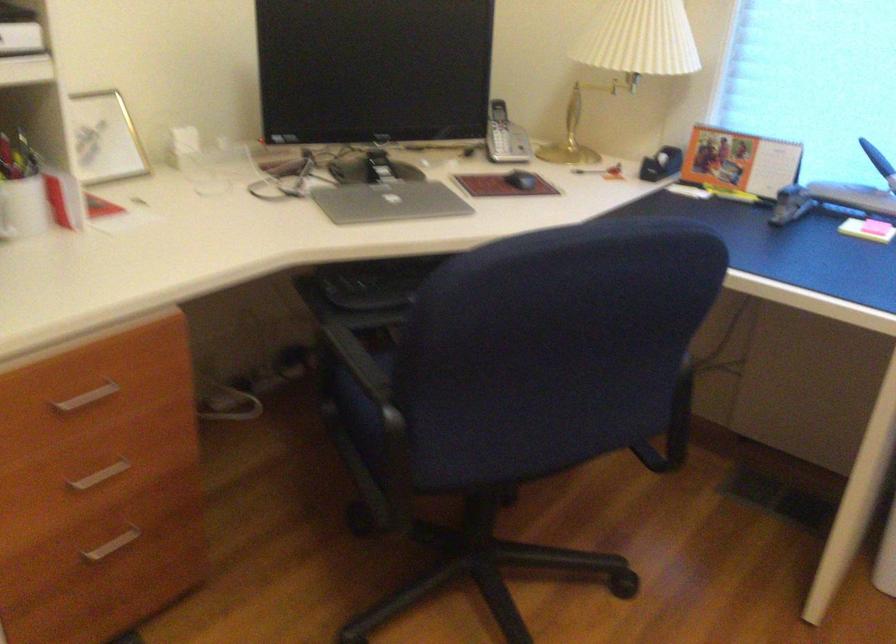
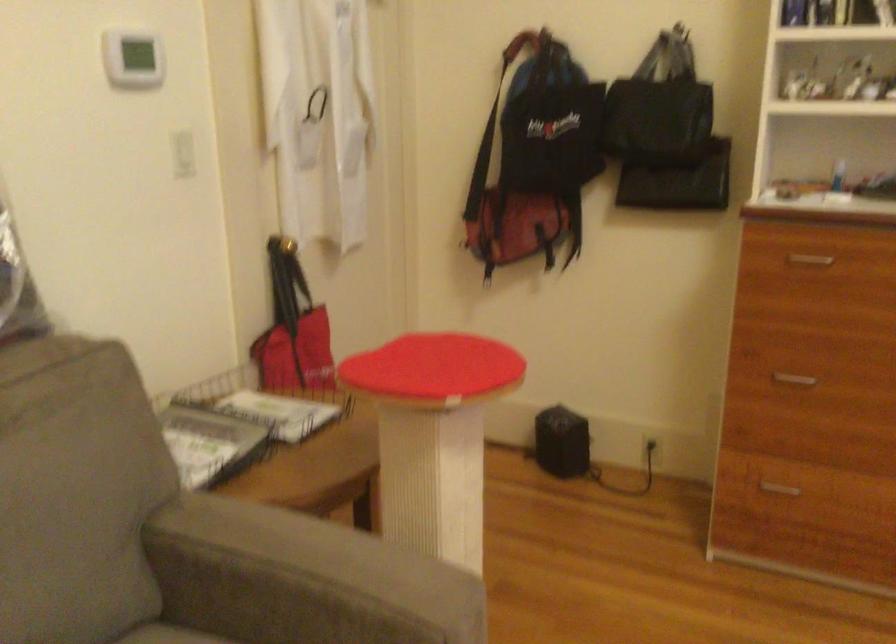
Question: The camera is either moving clockwise (left) or counter-clockwise (right) around the object. The first image is from the beginning of the video and the second image is from the end. Is the camera moving left or right when shooting the video?

Choices:
 (A) Left
 (B) Right

Answer: (B)